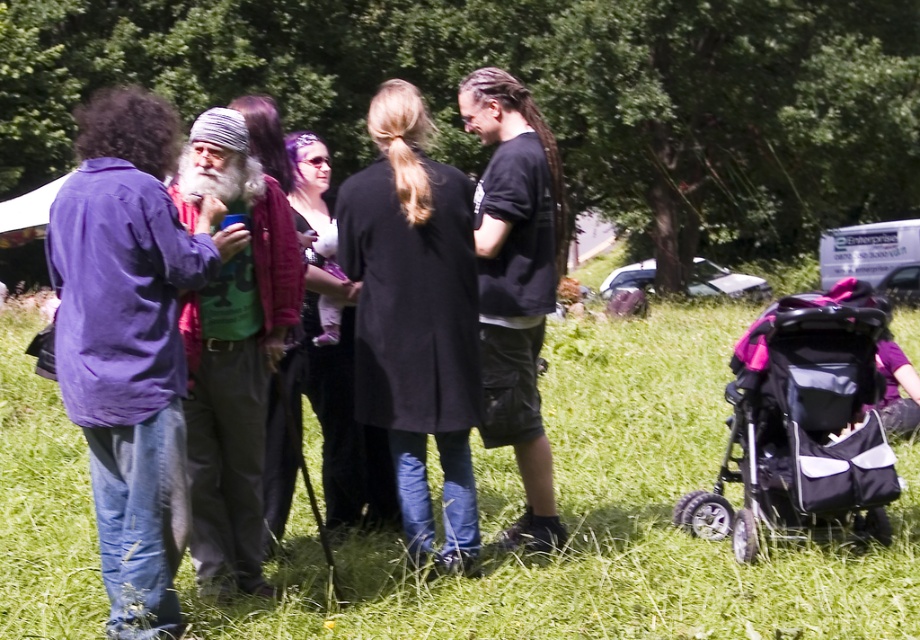
From the picture: Is green grass at center above matte purple jacket at center?

Indeed, green grass at center is positioned over matte purple jacket at center.

How far apart are green grass at center and matte purple jacket at center?

green grass at center and matte purple jacket at center are 15.79 feet apart from each other.

Between point (23, 570) and point (116, 506), which one is positioned in front?

Point (116, 506) is in front.

Where is `green grass at center`? The width and height of the screenshot is (920, 640). green grass at center is located at coordinates (602, 522).

Is pink fabric stroller at lower right behind black cotton t-shirt at center?

Yes.

Can you confirm if pink fabric stroller at lower right is positioned below black cotton t-shirt at center?

Yes.

Who is more forward, (841, 467) or (490, 372)?

Positioned in front is point (841, 467).

You are a GUI agent. You are given a task and a screenshot of the screen. Output one action in this format:
    pyautogui.click(x=<x>, y=<y>)
    Task: Click on the pink fabric stroller at lower right
    The height and width of the screenshot is (640, 920).
    Given the screenshot: What is the action you would take?
    pyautogui.click(x=805, y=422)

Does green grass at center appear on the left side of green cotton shirt at center?

Incorrect, green grass at center is not on the left side of green cotton shirt at center.

Between green grass at center and green cotton shirt at center, which one appears on the right side from the viewer's perspective?

Positioned to the right is green grass at center.

What do you see at coordinates (602, 522) in the screenshot? I see `green grass at center` at bounding box center [602, 522].

Find the location of a particular element. Image resolution: width=920 pixels, height=640 pixels. green grass at center is located at coordinates [602, 522].